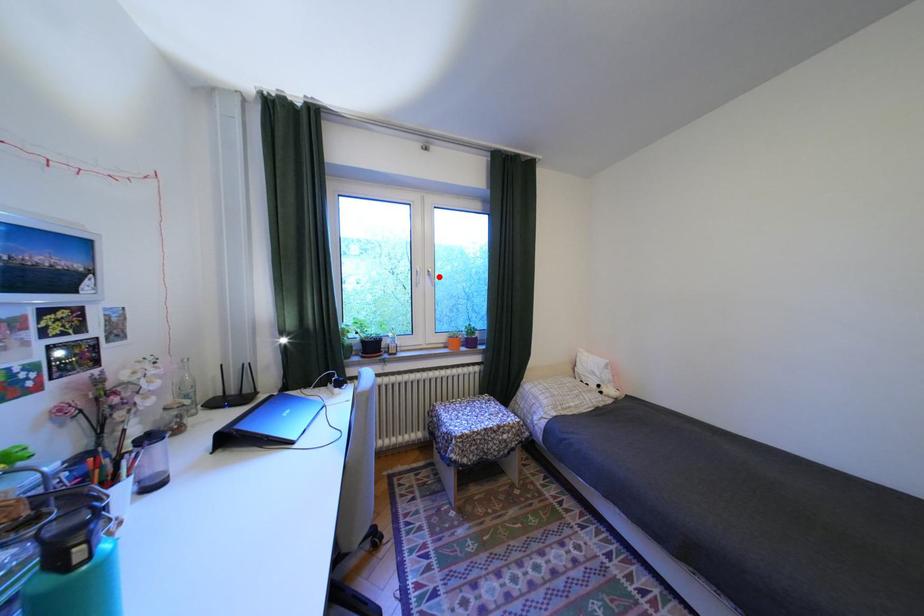
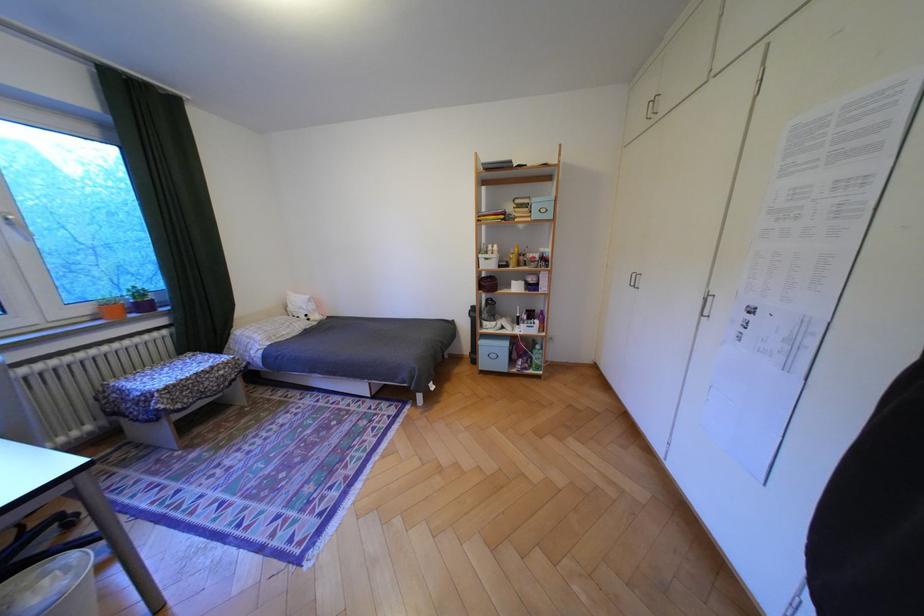
Locate, in the second image, the point that corresponds to the highlighted location in the first image.

(18, 227)